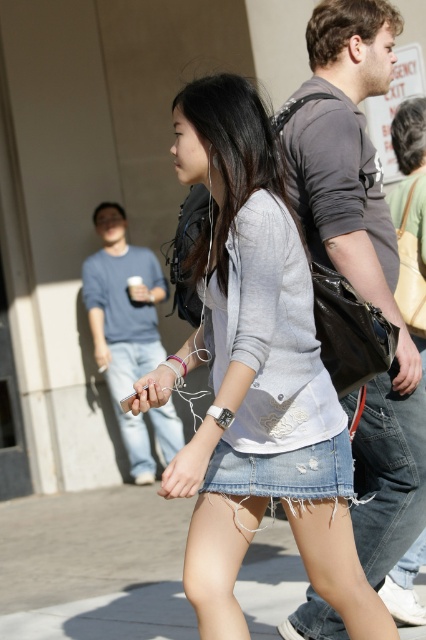
Based on the photo, based on the scene description, which denim skirt is positioned higher in the image, the denim skirt at center or the denim skirt at lower center?

The denim skirt at center is positioned higher than the denim skirt at lower center according to the description.